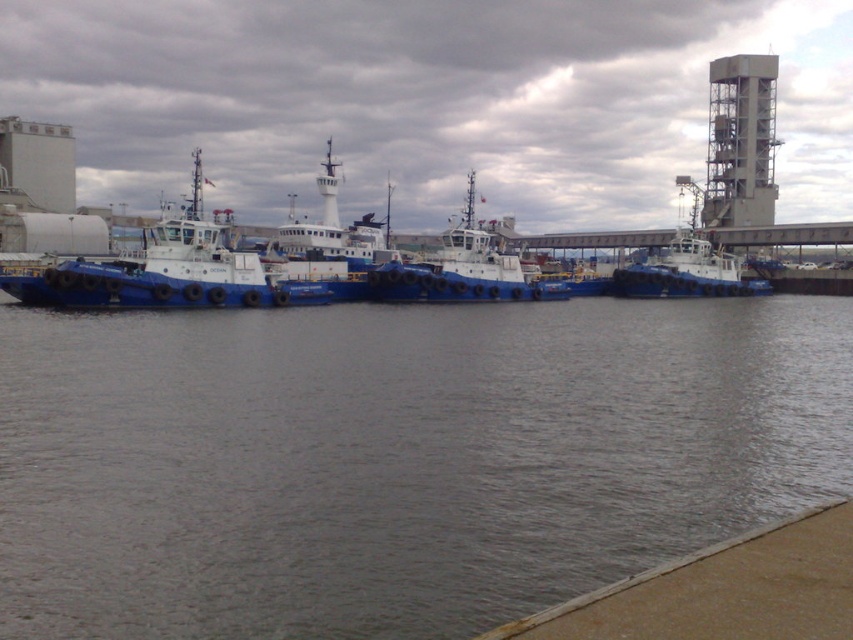
Based on the photo, you are a dock worker who needs to secure both the blue rubber boat at left and the blue rubber boat at right. Based on their positions, which boat should you secure first if you want to start from the highest point and work your way down?

The blue rubber boat at left should be secured first since it is located above the blue rubber boat at right, starting from the highest point.

Consider the image. You are a dock worker who needs to choose a boat to transport a large container. The container requires a boat with a minimum width of 3 meters. You see two blue rubber boats available. The blue rubber boat at center and the blue rubber boat at left. Which boat should you choose?

The blue rubber boat at left is wider than the blue rubber boat at center, so you should choose the blue rubber boat at left to transport the large container since it meets the minimum width requirement.